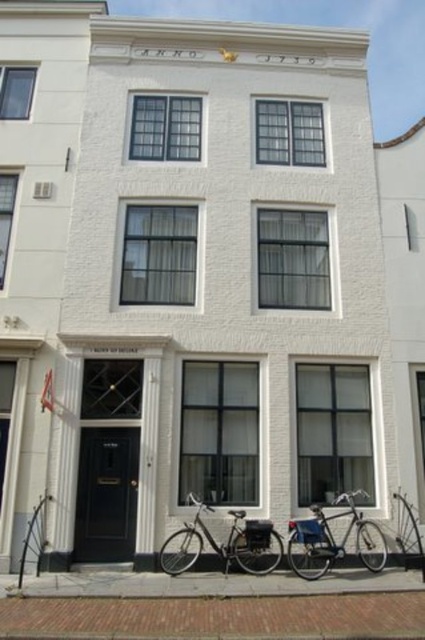
Question: Which point appears farthest from the camera in this image?

Choices:
 (A) (161, 554)
 (B) (311, 509)

Answer: (B)

Question: Which point appears closest to the camera in this image?

Choices:
 (A) (371, 560)
 (B) (221, 556)

Answer: (B)

Question: Which object appears closest to the camera in this image?

Choices:
 (A) shiny silver bicycle at lower center
 (B) shiny metallic bicycle at lower center

Answer: (B)

Question: Observing the image, what is the correct spatial positioning of shiny silver bicycle at lower center in reference to shiny metallic bicycle at lower center?

Choices:
 (A) left
 (B) right

Answer: (A)

Question: Does shiny silver bicycle at lower center come in front of shiny metallic bicycle at lower center?

Choices:
 (A) no
 (B) yes

Answer: (A)

Question: Is shiny silver bicycle at lower center closer to camera compared to shiny metallic bicycle at lower center?

Choices:
 (A) yes
 (B) no

Answer: (B)